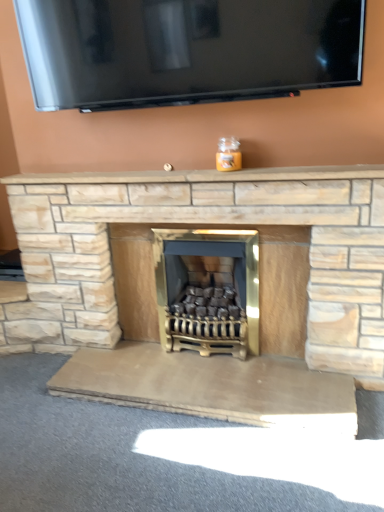
Question: Are gold metallic wood burning stove at center and beige stone mantle at center making contact?

Choices:
 (A) yes
 (B) no

Answer: (B)

Question: Is gold metallic wood burning stove at center facing towards beige stone mantle at center?

Choices:
 (A) yes
 (B) no

Answer: (B)

Question: Does gold metallic wood burning stove at center appear on the right side of beige stone mantle at center?

Choices:
 (A) no
 (B) yes

Answer: (B)

Question: Can you confirm if gold metallic wood burning stove at center is positioned to the left of beige stone mantle at center?

Choices:
 (A) no
 (B) yes

Answer: (A)

Question: Considering the relative sizes of gold metallic wood burning stove at center and beige stone mantle at center in the image provided, is gold metallic wood burning stove at center wider than beige stone mantle at center?

Choices:
 (A) yes
 (B) no

Answer: (A)

Question: Is natural stone fireplace at center spatially inside gold metallic wood burning stove at center, or outside of it?

Choices:
 (A) outside
 (B) inside

Answer: (A)

Question: From a real-world perspective, relative to gold metallic wood burning stove at center, is natural stone fireplace at center vertically above or below?

Choices:
 (A) above
 (B) below

Answer: (A)

Question: From their relative heights in the image, would you say natural stone fireplace at center is taller or shorter than gold metallic wood burning stove at center?

Choices:
 (A) short
 (B) tall

Answer: (B)

Question: From the image's perspective, is natural stone fireplace at center above or below gold metallic wood burning stove at center?

Choices:
 (A) below
 (B) above

Answer: (B)

Question: From a real-world perspective, relative to beige stone mantle at center, is gold metallic wood burning stove at center vertically above or below?

Choices:
 (A) below
 (B) above

Answer: (A)

Question: Based on their sizes in the image, would you say gold metallic wood burning stove at center is bigger or smaller than beige stone mantle at center?

Choices:
 (A) small
 (B) big

Answer: (B)

Question: In terms of height, does gold metallic wood burning stove at center look taller or shorter compared to beige stone mantle at center?

Choices:
 (A) tall
 (B) short

Answer: (A)

Question: Is gold metallic wood burning stove at center wider or thinner than beige stone mantle at center?

Choices:
 (A) thin
 (B) wide

Answer: (B)

Question: From the image's perspective, relative to natural stone fireplace at center, is beige stone mantle at center above or below?

Choices:
 (A) below
 (B) above

Answer: (B)

Question: From a real-world perspective, relative to natural stone fireplace at center, is beige stone mantle at center vertically above or below?

Choices:
 (A) above
 (B) below

Answer: (A)